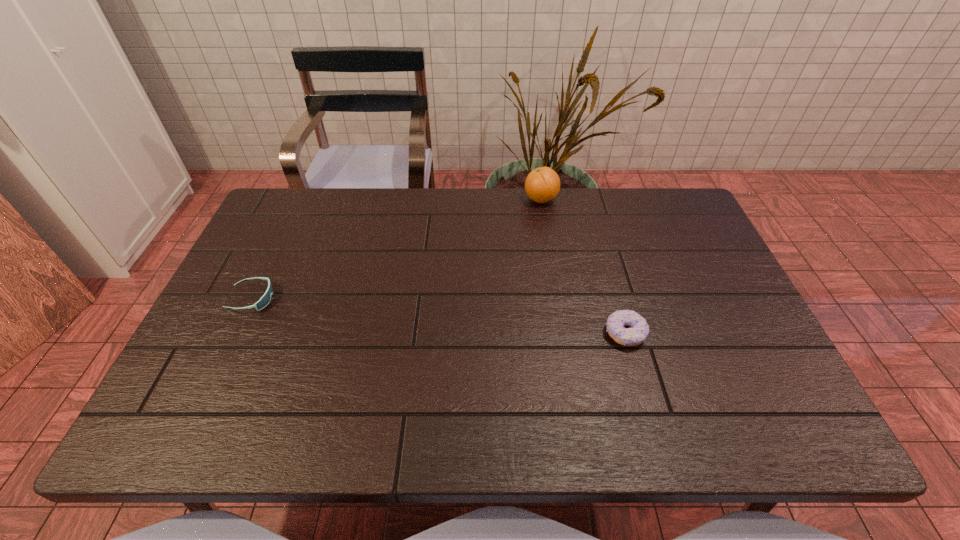
At what (x,y) coordinates should I click in order to perform the action: click on free space that is in between the doughnut and the orange. Please return your answer as a coordinate pair (x, y). The image size is (960, 540). Looking at the image, I should click on (583, 266).

What are the coordinates of `vacant point located between the nearest object and the farthest object` in the screenshot? It's located at (583, 266).

At what (x,y) coordinates should I click in order to perform the action: click on free space between the doughnut and the leftmost object. Please return your answer as a coordinate pair (x, y). The image size is (960, 540). Looking at the image, I should click on (439, 316).

You are a GUI agent. You are given a task and a screenshot of the screen. Output one action in this format:
    pyautogui.click(x=<x>, y=<y>)
    Task: Click on the free space between the second shortest object and the goggles
    Image resolution: width=960 pixels, height=540 pixels.
    Given the screenshot: What is the action you would take?
    pyautogui.click(x=439, y=316)

Image resolution: width=960 pixels, height=540 pixels. In order to click on free space that is in between the second tallest object and the goggles in this screenshot , I will do `click(439, 316)`.

Where is `free point between the tallest object and the goggles`? Image resolution: width=960 pixels, height=540 pixels. free point between the tallest object and the goggles is located at coordinates (396, 249).

Locate an element on the screen. This screenshot has height=540, width=960. free space that is in between the leftmost object and the second object from right to left is located at coordinates (396, 249).

I want to click on object that is the second closest to the nearest object, so click(x=265, y=299).

The image size is (960, 540). In order to click on object that ranks as the closest to the second shortest object in this screenshot , I will do `click(542, 185)`.

At what (x,y) coordinates should I click in order to perform the action: click on blank area in the image that satisfies the following two spatial constraints: 1. on the back side of the second tallest object; 2. on the front-facing side of the second farthest object. Please return your answer as a coordinate pair (x, y). The image size is (960, 540). Looking at the image, I should click on (615, 299).